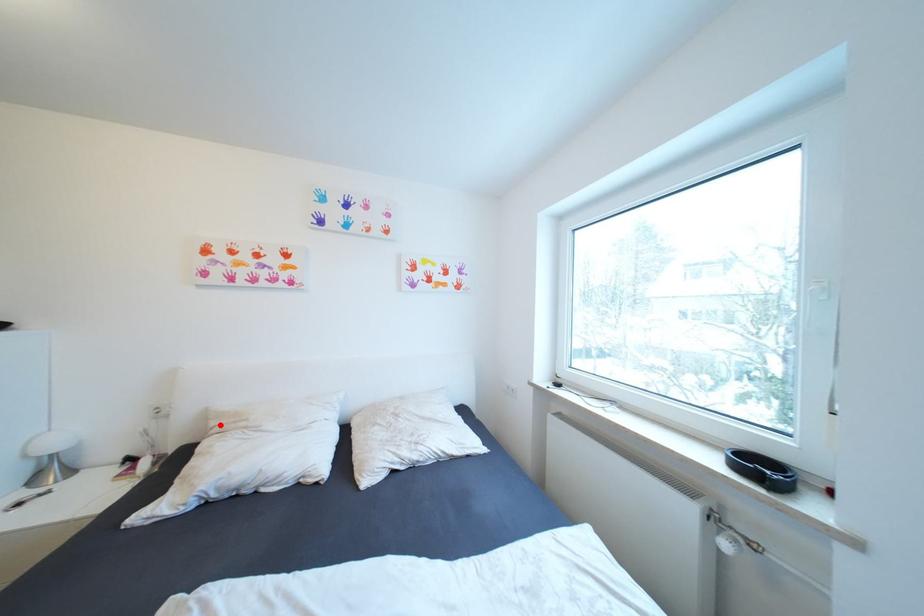
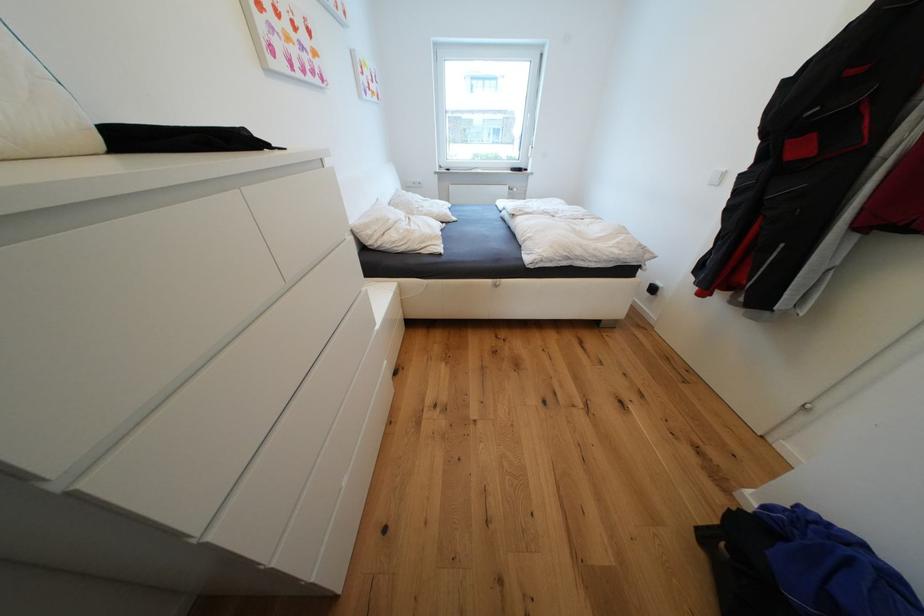
In the second image, find the point that corresponds to the highlighted location in the first image.

(377, 233)